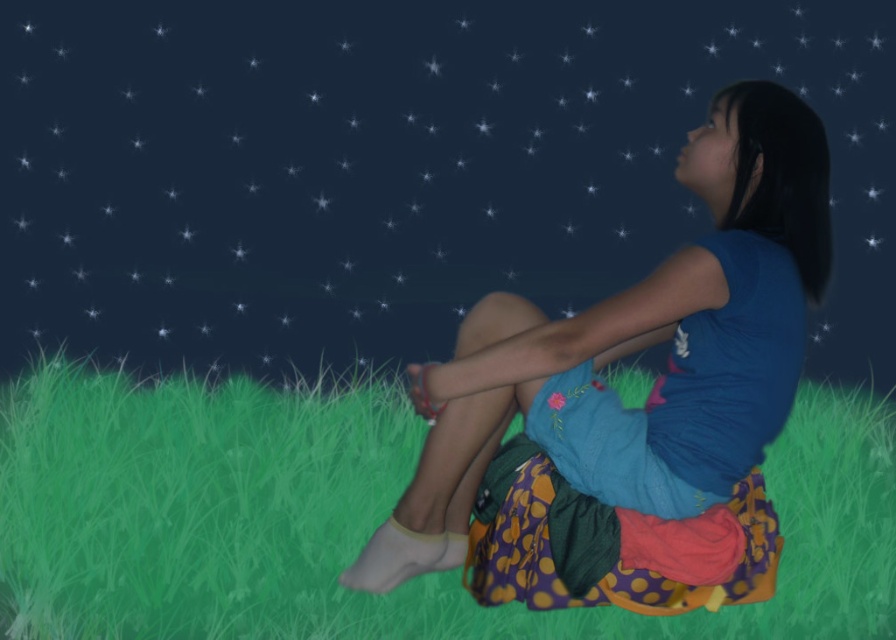
You are a photographer trying to capture the perfect shot of the matte blue dress at center and the green grassy at lower center. Which object is wider in the image?

The matte blue dress at center is wider than the green grassy at lower center.

You are a photographer trying to capture a clear shot of the matte blue dress at center and the matte blue shirt at center. Which one should you focus on first to ensure it appears sharp in the photo?

You should focus on the matte blue dress at center first because it is closer to the viewer than the matte blue shirt at center, ensuring it stays sharp.

You are a photographer trying to capture the girl in the matte blue shirt at center while ensuring the green grassy at lower center is visible in the frame. Based on their positions, which direction should you move your camera to include both subjects?

Since the green grassy at lower center is to the left of the matte blue shirt at center, you should move your camera slightly to the left to include both the green grassy at lower center and the matte blue shirt at center in the frame.